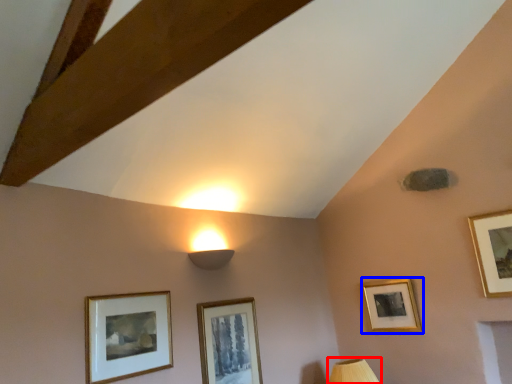
Question: Among these objects, which one is farthest to the camera, table lamp (highlighted by a red box) or picture frame (highlighted by a blue box)?

Choices:
 (A) table lamp
 (B) picture frame

Answer: (B)